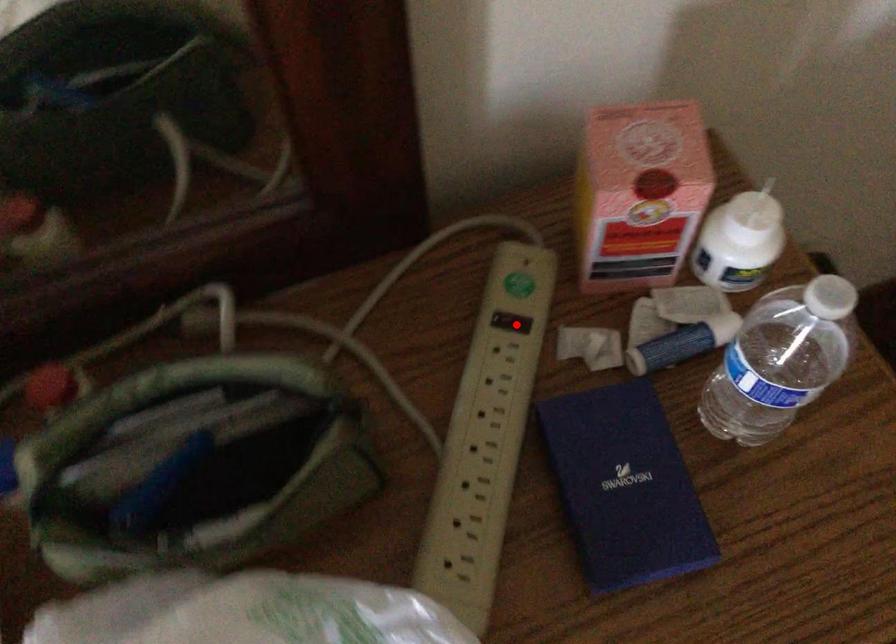
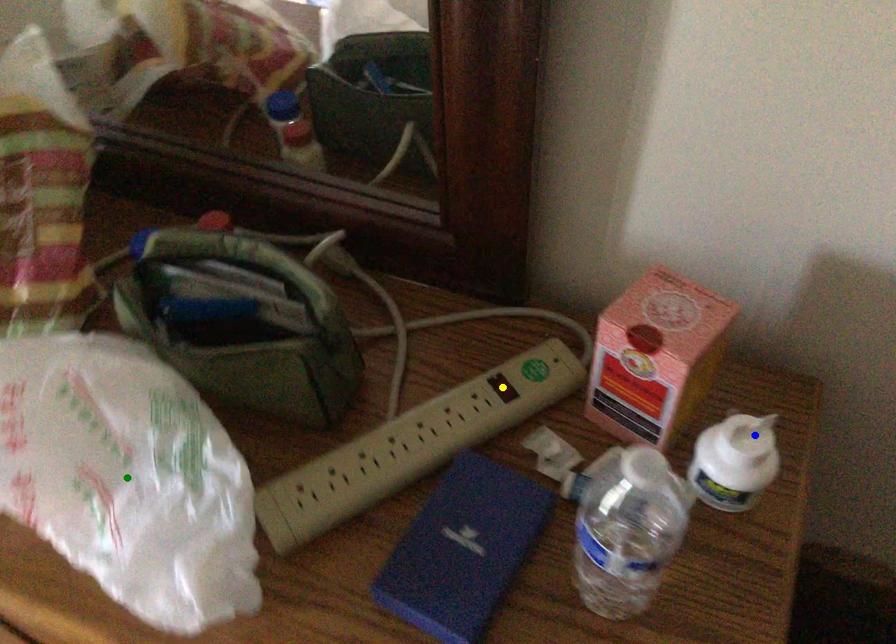
Question: I am providing you with two images of the same scene from different viewpoints. A red point is marked on the first image. You are given multiple points on the second image. Can you choose the point in image 2 that corresponds to the point in image 1?

Choices:
 (A) blue point
 (B) green point
 (C) yellow point

Answer: (C)